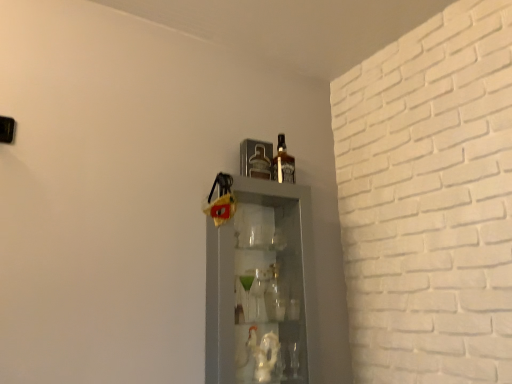
Question: Considering the positions of brown glass bottle at upper center and clear glass cabinet at center in the image, is brown glass bottle at upper center taller or shorter than clear glass cabinet at center?

Choices:
 (A) tall
 (B) short

Answer: (B)

Question: From the image's perspective, is brown glass bottle at upper center located above or below clear glass cabinet at center?

Choices:
 (A) above
 (B) below

Answer: (A)

Question: Is brown glass bottle at upper center in front of or behind clear glass cabinet at center in the image?

Choices:
 (A) front
 (B) behind

Answer: (B)

Question: From the image's perspective, is clear glass cabinet at center located above or below brown glass bottle at upper center?

Choices:
 (A) above
 (B) below

Answer: (B)

Question: Is point click(292, 241) positioned closer to the camera than point click(282, 137)?

Choices:
 (A) farther
 (B) closer

Answer: (B)

Question: Considering the positions of clear glass cabinet at center and brown glass bottle at upper center in the image, is clear glass cabinet at center taller or shorter than brown glass bottle at upper center?

Choices:
 (A) tall
 (B) short

Answer: (A)

Question: Considering their positions, is clear glass cabinet at center located in front of or behind brown glass bottle at upper center?

Choices:
 (A) front
 (B) behind

Answer: (A)